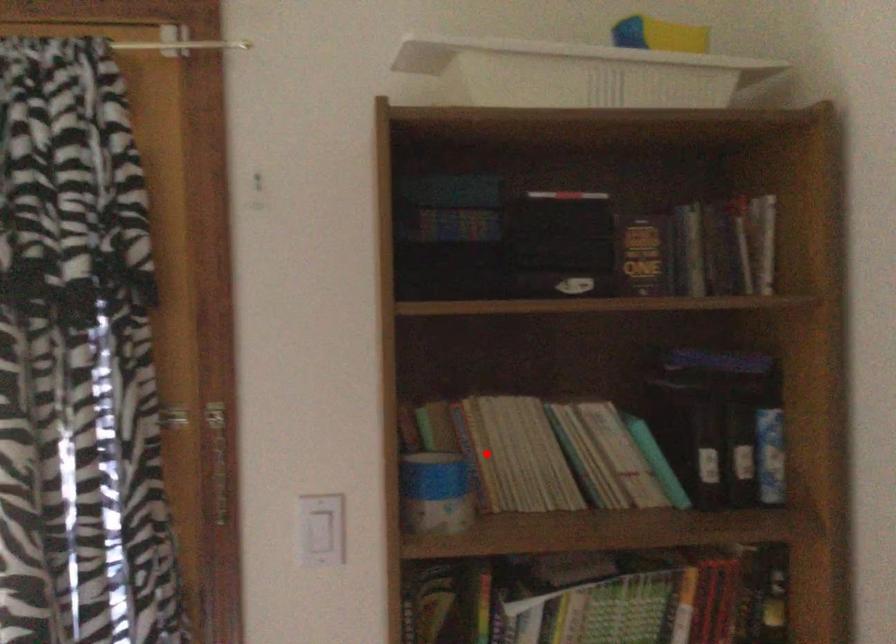
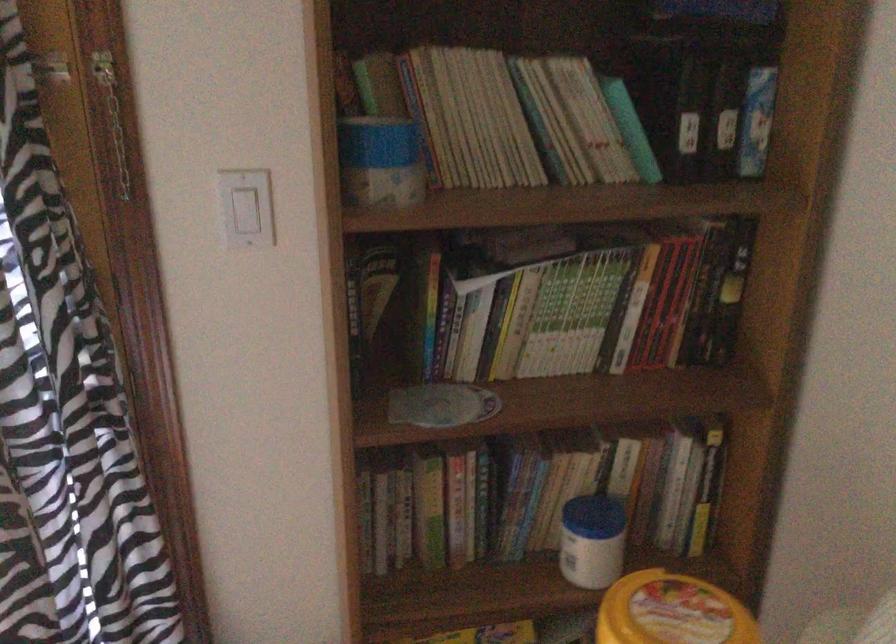
Question: I am providing you with two images of the same scene from different viewpoints. Image1 has a red point marked. In image2, the corresponding 3D location appears at what relative position? Reply with the corresponding letter.

Choices:
 (A) Closer
 (B) Farther

Answer: (A)